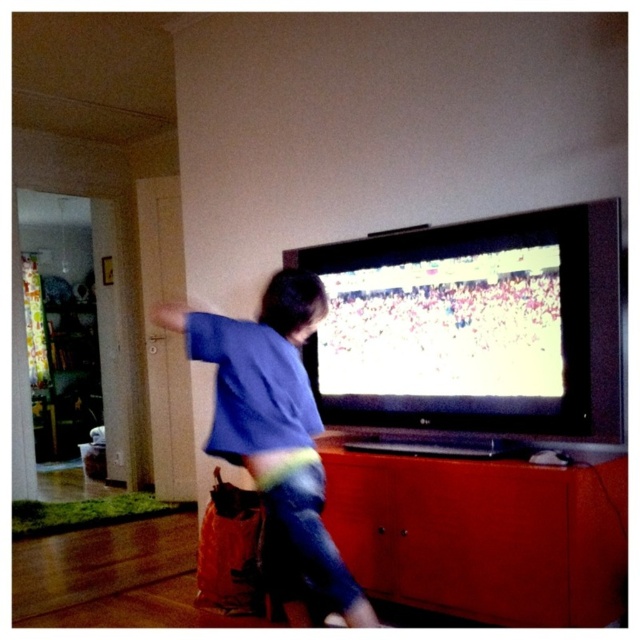
You are trying to place the blue cotton shirt at center on the matte wood dresser at lower center. Can you fit it based on their sizes?

The matte wood dresser at lower center is wider than the blue cotton shirt at center, so yes, the shirt can fit on the dresser.

You are standing at point (259,356) and want to walk to point (410,513). Which direction should you move?

You should move backward to reach point (410,513) since it is behind point (259,356) from your current position.

You are a parent trying to put away laundry. You have a blue cotton shirt at center that needs to be folded and stored. Given the space available on the matte wood dresser at lower center, will the shirt fit properly without needing to be folded?

The matte wood dresser at lower center is larger in size than the blue cotton shirt at center, so the shirt will fit properly without needing to be folded.